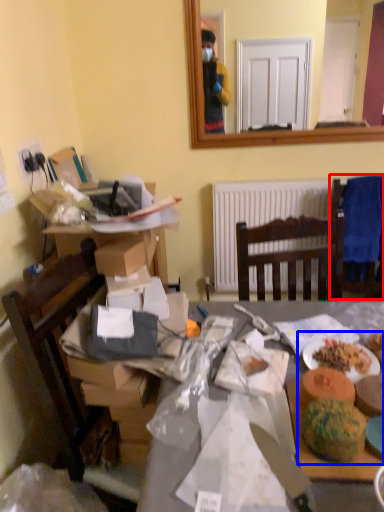
Question: Which object appears farthest to the camera in this image, chair (highlighted by a red box) or food (highlighted by a blue box)?

Choices:
 (A) chair
 (B) food

Answer: (A)